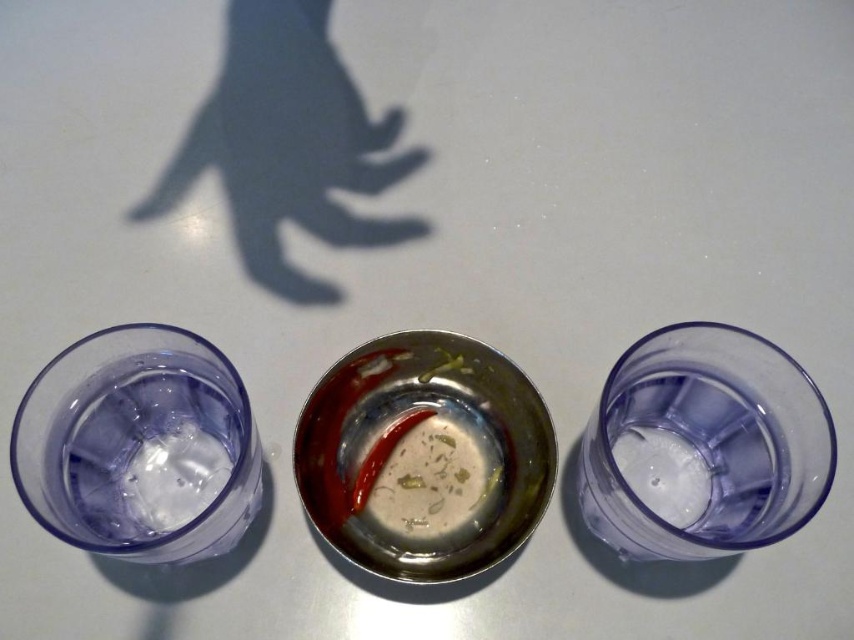
Question: Among these objects, which one is nearest to the camera?

Choices:
 (A) transparent plastic shot glass at center right
 (B) transparent plastic shot glass at left

Answer: (B)

Question: Can you confirm if transparent plastic shot glass at center right is positioned to the right of transparent plastic shot glass at left?

Choices:
 (A) yes
 (B) no

Answer: (A)

Question: Is transparent plastic shot glass at center right above transparent plastic shot glass at left?

Choices:
 (A) yes
 (B) no

Answer: (B)

Question: Can you confirm if transparent plastic shot glass at center right is positioned to the left of transparent plastic shot glass at left?

Choices:
 (A) yes
 (B) no

Answer: (B)

Question: Which object is farther from the camera taking this photo?

Choices:
 (A) transparent plastic shot glass at center right
 (B) transparent plastic shot glass at left

Answer: (A)

Question: Among these objects, which one is farthest from the camera?

Choices:
 (A) transparent plastic shot glass at center right
 (B) transparent plastic shot glass at left

Answer: (A)